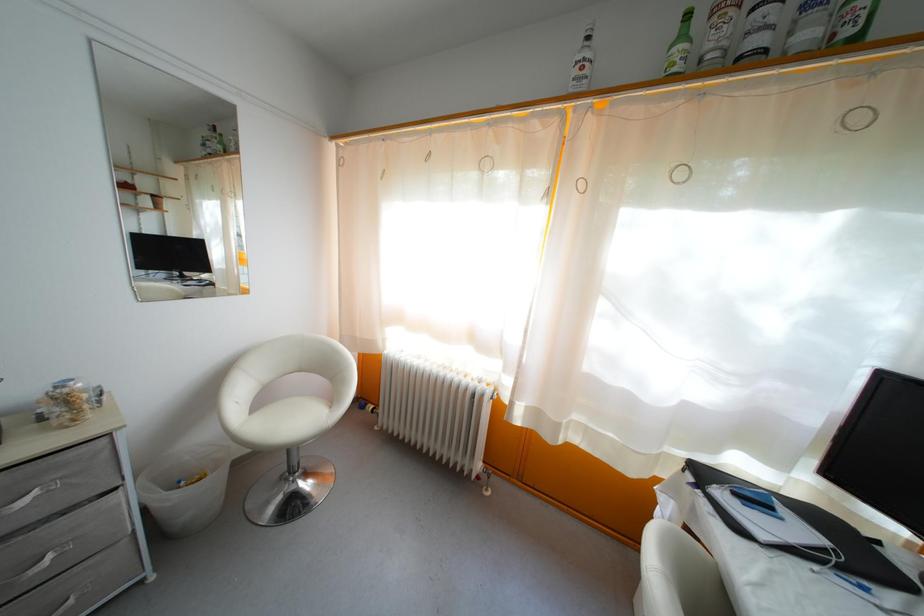
Find the location of `white chair sitting surface`. white chair sitting surface is located at coordinates (285, 421).